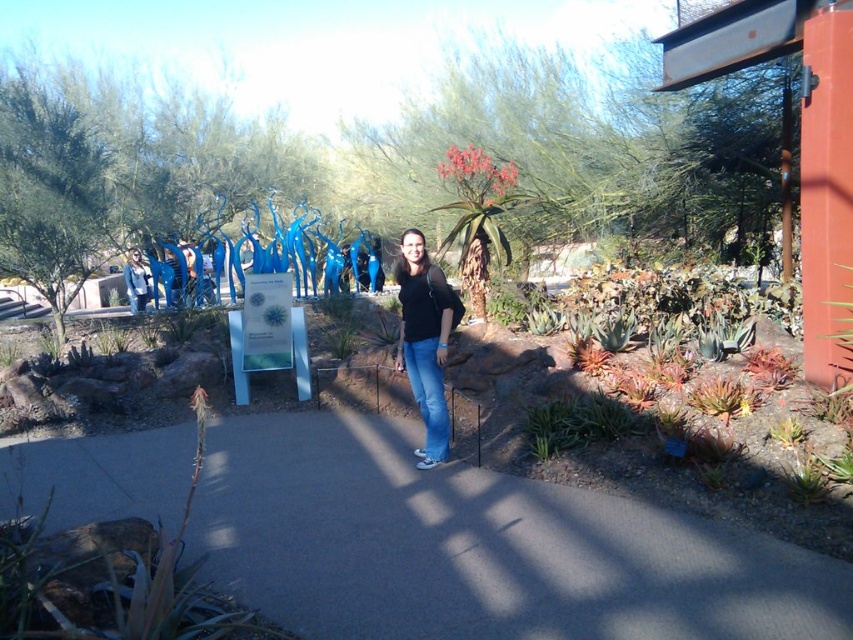
You are standing at the entrance of the botanical garden and see the gray concrete path at center and the black matte shirt at center. Which object is closer to you?

The gray concrete path at center is closer to the viewer than the black matte shirt at center.